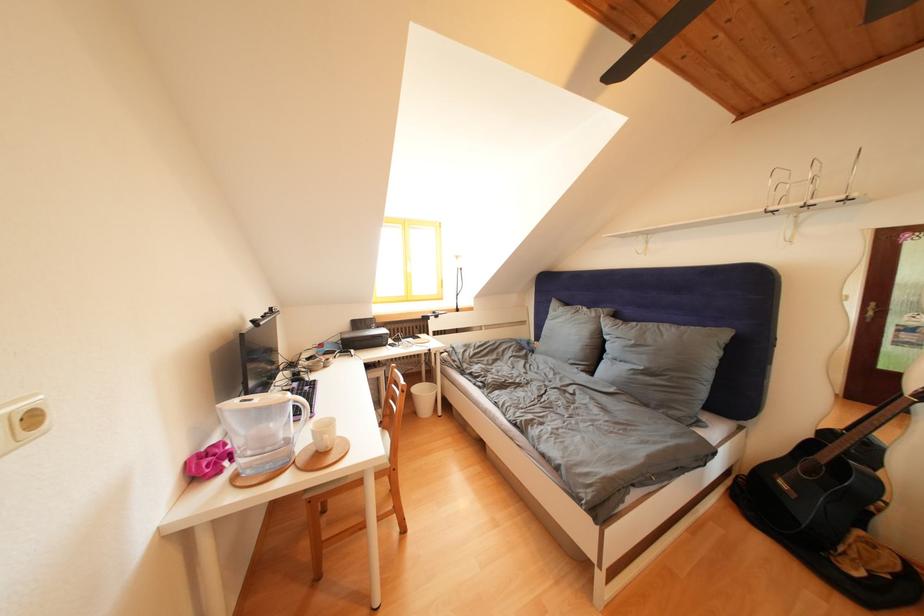
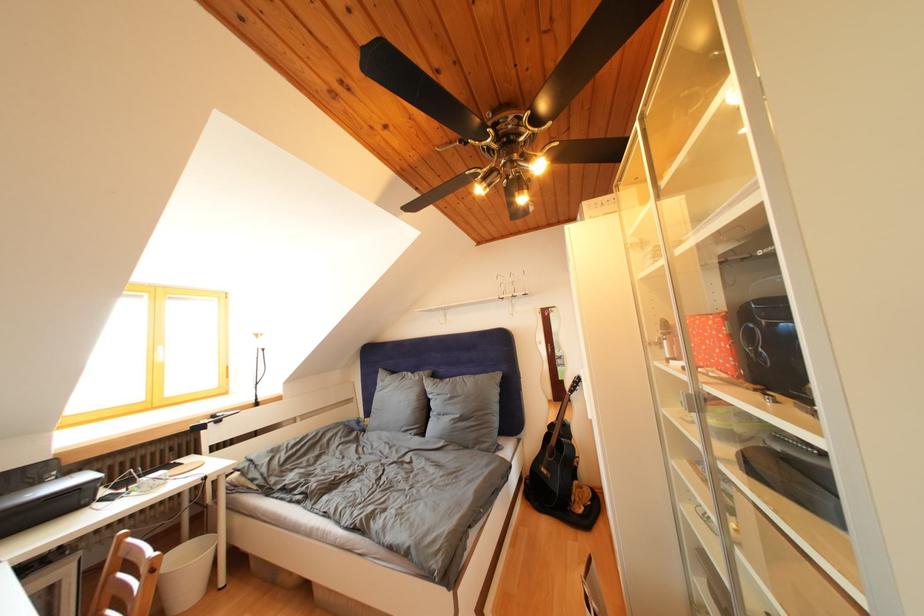
Where in the second image is the point corresponding to point (433, 399) from the first image?

(198, 565)